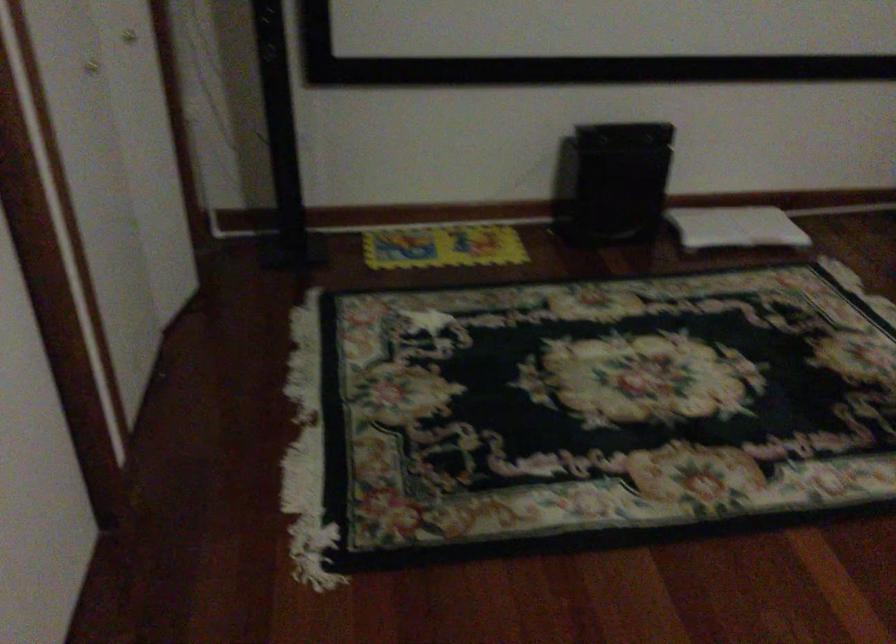
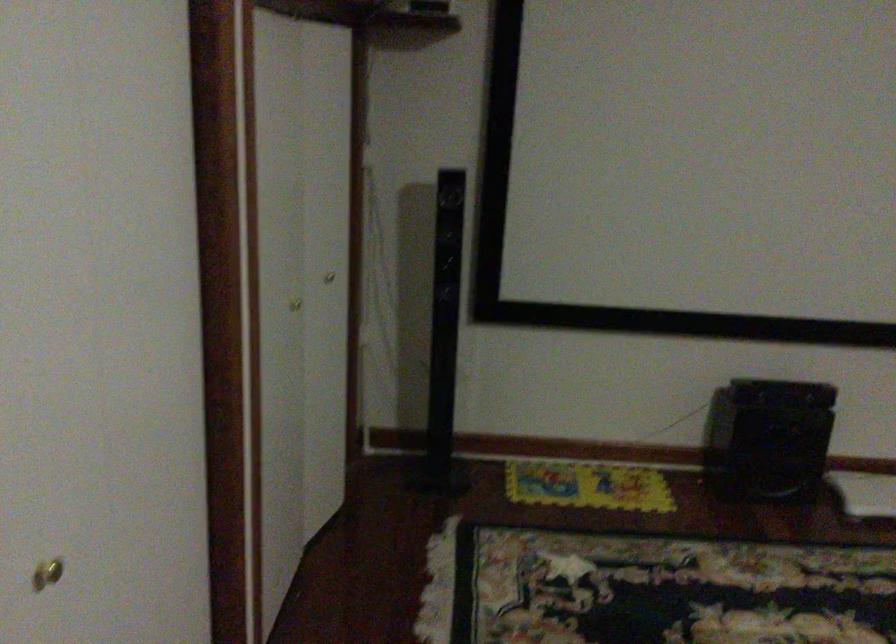
The images are taken continuously from a first-person perspective. In which direction are you moving?

The cameraman moved toward left, backward.